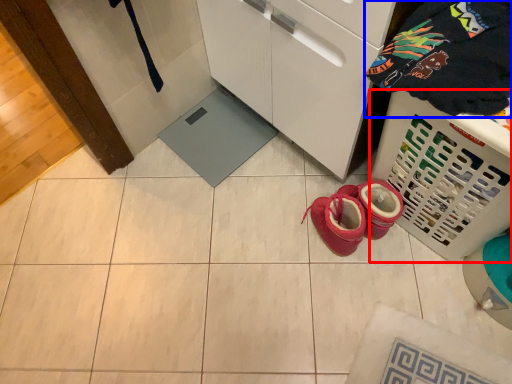
Question: Which of the following is the closest to the observer, basket (highlighted by a red box) or clothing (highlighted by a blue box)?

Choices:
 (A) basket
 (B) clothing

Answer: (B)